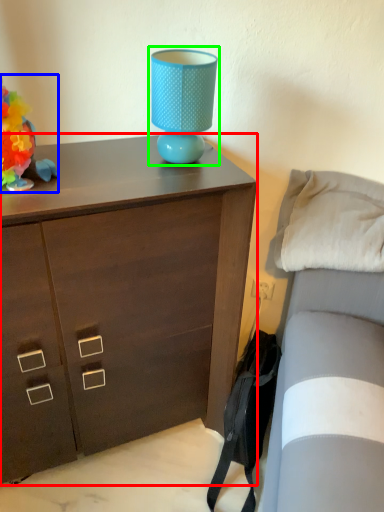
Question: Which object is positioned closest to chest of drawers (highlighted by a red box)? Select from toy (highlighted by a blue box) and table lamp (highlighted by a green box).

Choices:
 (A) toy
 (B) table lamp

Answer: (B)